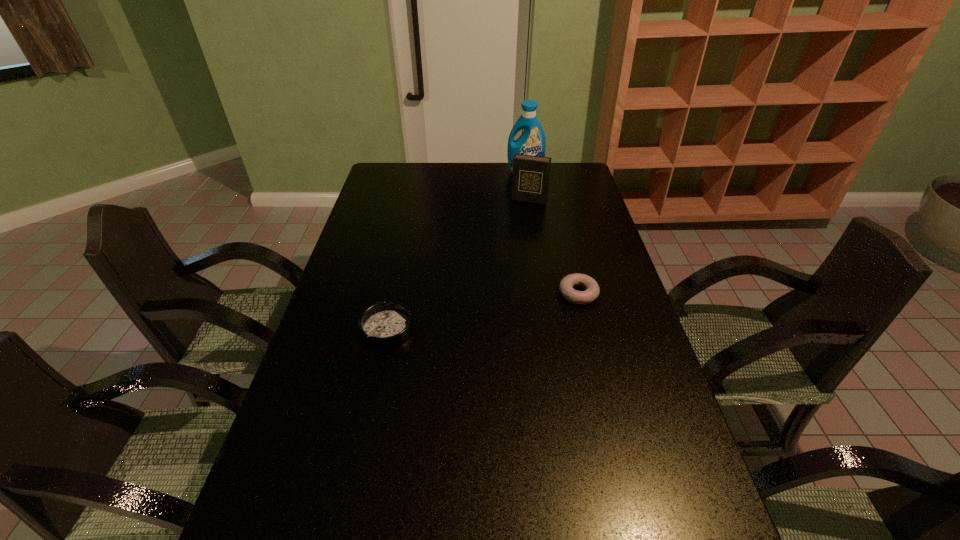
You are a GUI agent. You are given a task and a screenshot of the screen. Output one action in this format:
    pyautogui.click(x=<x>, y=<y>)
    Task: Click on the blank area located on the front cover of the second farthest object
    
    Given the screenshot: What is the action you would take?
    pyautogui.click(x=522, y=213)

This screenshot has height=540, width=960. Find the location of `vacant region located on the front cover of the second farthest object`. vacant region located on the front cover of the second farthest object is located at coordinates (520, 219).

Identify the location of vacant space located 0.350m on the front-facing side of the detergent. This screenshot has width=960, height=540. (516, 222).

Where is `vacant space located 0.320m on the front-facing side of the detergent`? The height and width of the screenshot is (540, 960). vacant space located 0.320m on the front-facing side of the detergent is located at coordinates (516, 218).

The width and height of the screenshot is (960, 540). I want to click on vacant area situated on the front-facing side of the detergent, so click(519, 201).

The width and height of the screenshot is (960, 540). Find the location of `object at the far edge`. object at the far edge is located at coordinates (532, 141).

Identify the location of object present at the left edge. (382, 325).

I want to click on object that is positioned at the right edge, so click(x=592, y=290).

You are a GUI agent. You are given a task and a screenshot of the screen. Output one action in this format:
    pyautogui.click(x=<x>, y=<y>)
    Task: Click on the free space at the far edge of the desktop
    This screenshot has height=540, width=960.
    Given the screenshot: What is the action you would take?
    pyautogui.click(x=508, y=167)

The width and height of the screenshot is (960, 540). I want to click on free space at the near edge of the desktop, so click(593, 509).